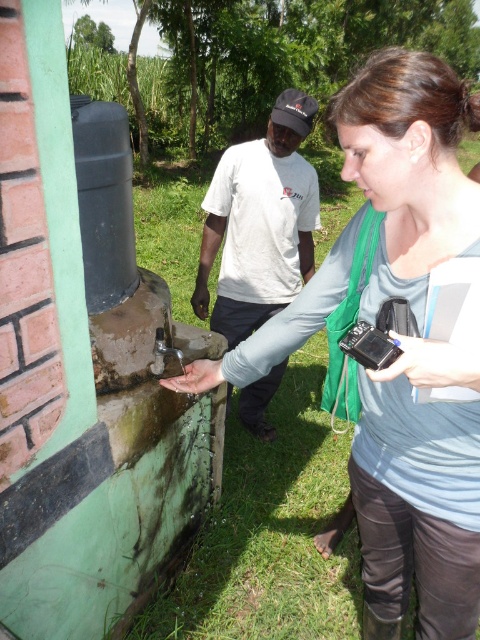
Does matte gray shirt at center appear on the right side of white cotton shirt at center?

Correct, you'll find matte gray shirt at center to the right of white cotton shirt at center.

Who is more distant from viewer, (x=370, y=378) or (x=286, y=170)?

Point (x=286, y=170)

The height and width of the screenshot is (640, 480). What do you see at coordinates (418, 496) in the screenshot?
I see `matte gray shirt at center` at bounding box center [418, 496].

Locate an element on the screen. The image size is (480, 640). matte gray shirt at center is located at coordinates (418, 496).